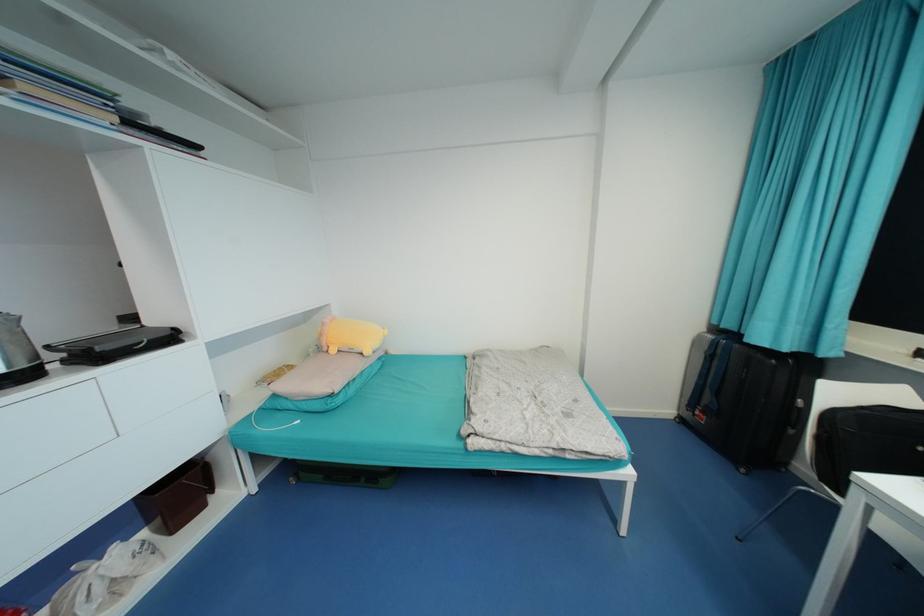
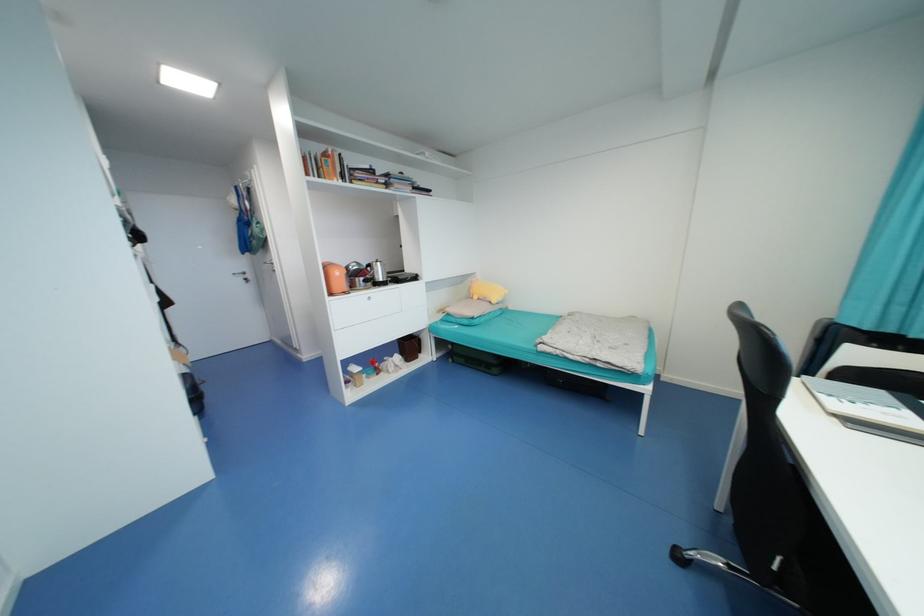
In the second image, find the point that corresponds to the point at 337,351 in the first image.

(480, 299)